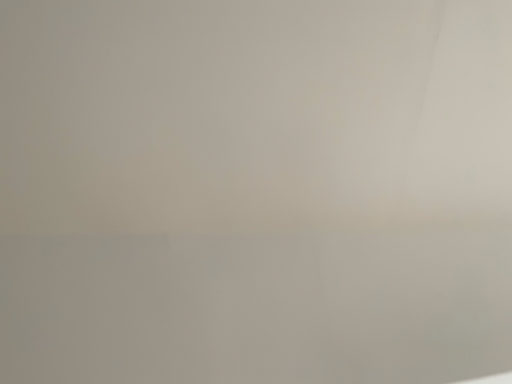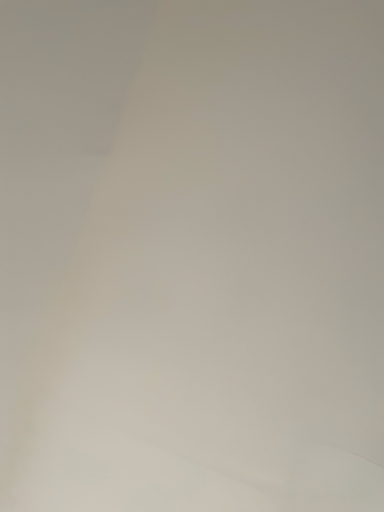
Question: Which way did the camera rotate in the video?

Choices:
 (A) rotated right
 (B) rotated left

Answer: (A)